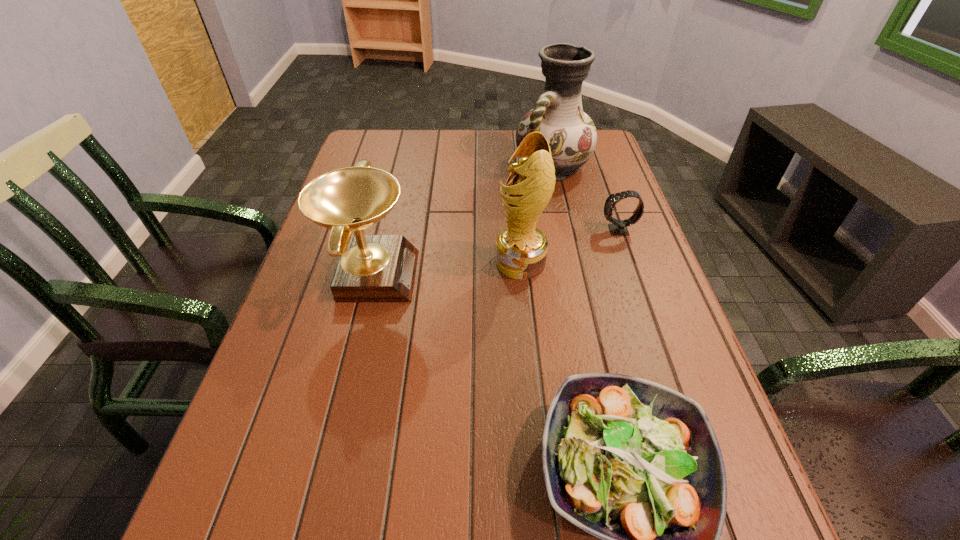
You are a GUI agent. You are given a task and a screenshot of the screen. Output one action in this format:
    pyautogui.click(x=<x>, y=<y>)
    Task: Click on the free space that satisfies the following two spatial constraints: 1. on the front side of the farthest object; 2. on the front-facing side of the taller award
    The image size is (960, 540).
    Given the screenshot: What is the action you would take?
    pyautogui.click(x=574, y=262)